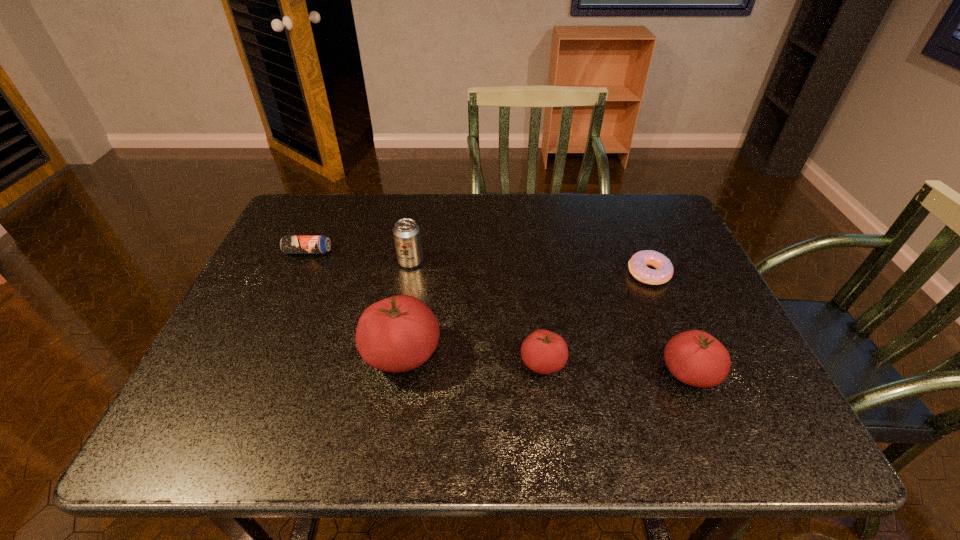
Where is `vacant region located on the left of the third object from right to left`? Image resolution: width=960 pixels, height=540 pixels. vacant region located on the left of the third object from right to left is located at coordinates (409, 363).

You are a GUI agent. You are given a task and a screenshot of the screen. Output one action in this format:
    pyautogui.click(x=<x>, y=<y>)
    Task: Click on the free spot located 0.180m on the left of the second shortest tomato
    The image size is (960, 540).
    Given the screenshot: What is the action you would take?
    pyautogui.click(x=575, y=373)

This screenshot has width=960, height=540. Find the location of `free region located on the back of the doughnut`. free region located on the back of the doughnut is located at coordinates (624, 213).

Find the location of a particular element. Image resolution: width=960 pixels, height=540 pixels. vacant space located 0.300m on the right of the shorter beer can is located at coordinates (438, 252).

Locate an element on the screen. The height and width of the screenshot is (540, 960). vacant space located on the back of the taller beer can is located at coordinates [x=422, y=195].

Where is `object present at the left edge`? object present at the left edge is located at coordinates (289, 244).

Identify the location of tomato situated at the right edge. Image resolution: width=960 pixels, height=540 pixels. (696, 358).

Locate an element on the screen. doughnut that is at the right edge is located at coordinates (638, 265).

What are the coordinates of `object that is at the near right corner` in the screenshot? It's located at (696, 358).

Locate an element on the screen. vacant space at the far edge is located at coordinates (427, 227).